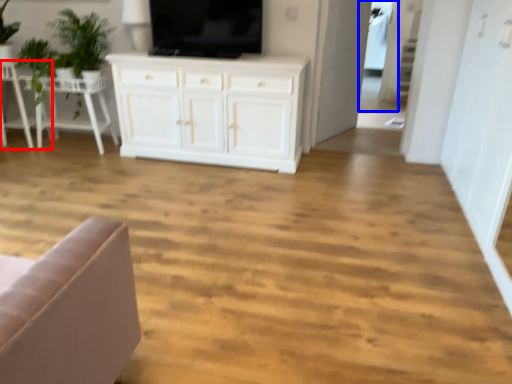
Question: Which object appears closest to the camera in this image, chair (highlighted by a red box) or glass door (highlighted by a blue box)?

Choices:
 (A) chair
 (B) glass door

Answer: (A)